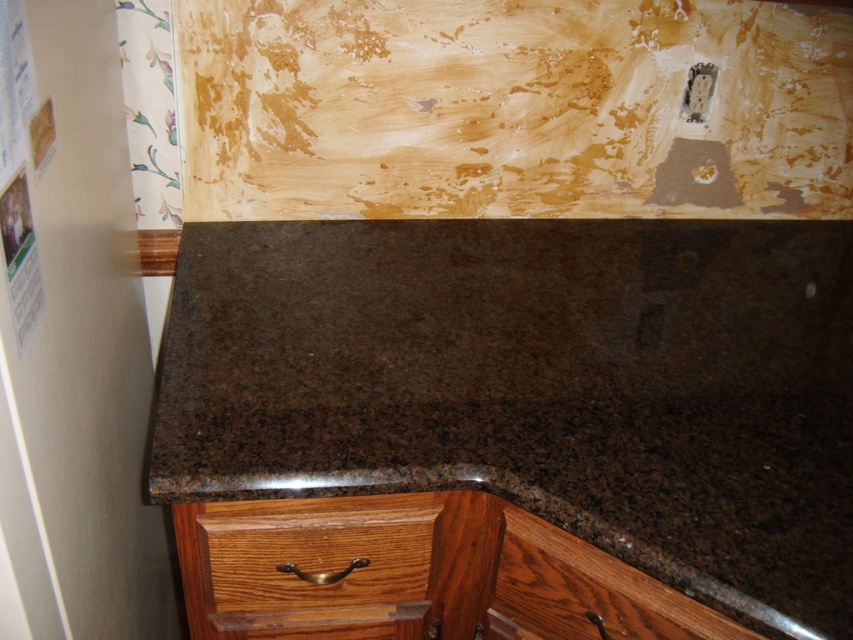
Does brown granite countertop at center have a smaller size compared to brown wood drawer at lower center?

Incorrect, brown granite countertop at center is not smaller in size than brown wood drawer at lower center.

Can you confirm if brown granite countertop at center is positioned below brown wood drawer at lower center?

No, brown granite countertop at center is not below brown wood drawer at lower center.

Describe the element at coordinates (538, 385) in the screenshot. I see `brown granite countertop at center` at that location.

The image size is (853, 640). What are the coordinates of `brown granite countertop at center` in the screenshot? It's located at (538, 385).